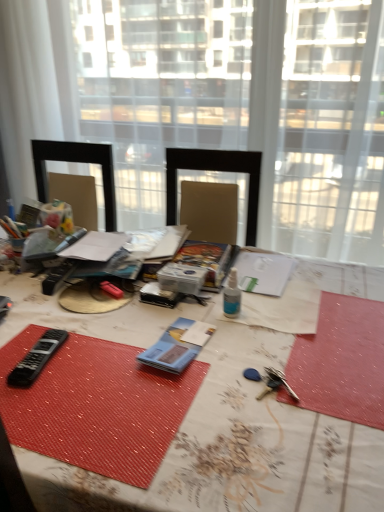
Question: Should I look upward or downward to see blue paper at center, the first equipment when ordered from right to left?

Choices:
 (A) up
 (B) down

Answer: (B)

Question: Can you confirm if transparent glass window at center, which is the 1th window from right to left, is taller than blue paper at center, which is the second equipment in left-to-right order?

Choices:
 (A) no
 (B) yes

Answer: (B)

Question: From the image's perspective, is transparent glass window at center, which is the 1th window from right to left, on top of blue paper at center, which is the second equipment in left-to-right order?

Choices:
 (A) no
 (B) yes

Answer: (B)

Question: Is transparent glass window at center, which is the 1th window from right to left, surrounding blue paper at center, which is the second equipment in left-to-right order?

Choices:
 (A) no
 (B) yes

Answer: (A)

Question: Does transparent glass window at center, acting as the 2th window starting from the left, appear on the right side of blue paper at center, which is the second equipment in left-to-right order?

Choices:
 (A) no
 (B) yes

Answer: (B)

Question: Is transparent glass window at center, which is the 1th window from right to left, not near blue paper at center, which is the second equipment in left-to-right order?

Choices:
 (A) yes
 (B) no

Answer: (A)

Question: From a real-world perspective, is transparent glass window at center, which is the 1th window from right to left, located higher than blue paper at center, the first equipment when ordered from right to left?

Choices:
 (A) yes
 (B) no

Answer: (A)

Question: From the image's perspective, is blue paper at center, which is the second equipment in left-to-right order, located beneath transparent glass window at center, the first window when ordered from left to right?

Choices:
 (A) no
 (B) yes

Answer: (B)

Question: Can you confirm if blue paper at center, the first equipment when ordered from right to left, is wider than transparent glass window at center, the second window viewed from the right?

Choices:
 (A) yes
 (B) no

Answer: (A)

Question: Is blue paper at center, which is the second equipment in left-to-right order, thinner than transparent glass window at center, the second window viewed from the right?

Choices:
 (A) yes
 (B) no

Answer: (B)

Question: From a real-world perspective, does blue paper at center, which is the second equipment in left-to-right order, sit lower than transparent glass window at center, the second window viewed from the right?

Choices:
 (A) yes
 (B) no

Answer: (A)

Question: Is blue paper at center, which is the second equipment in left-to-right order, behind transparent glass window at center, the second window viewed from the right?

Choices:
 (A) no
 (B) yes

Answer: (A)

Question: Are blue paper at center, which is the second equipment in left-to-right order, and transparent glass window at center, the second window viewed from the right, making contact?

Choices:
 (A) no
 (B) yes

Answer: (A)

Question: Does blue paper at center, the first equipment when ordered from right to left, have a greater width compared to white textured table at center?

Choices:
 (A) yes
 (B) no

Answer: (B)